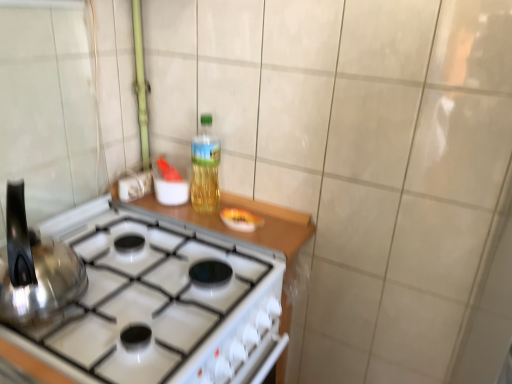
Question: Considering the relative sizes of translucent plastic bottle at center and satin silver kettle at left in the image provided, is translucent plastic bottle at center wider than satin silver kettle at left?

Choices:
 (A) yes
 (B) no

Answer: (B)

Question: Can you confirm if translucent plastic bottle at center is bigger than satin silver kettle at left?

Choices:
 (A) yes
 (B) no

Answer: (B)

Question: Is translucent plastic bottle at center touching satin silver kettle at left?

Choices:
 (A) no
 (B) yes

Answer: (A)

Question: Is translucent plastic bottle at center outside satin silver kettle at left?

Choices:
 (A) yes
 (B) no

Answer: (A)

Question: Can you confirm if translucent plastic bottle at center is positioned to the left of satin silver kettle at left?

Choices:
 (A) yes
 (B) no

Answer: (B)

Question: Considering the relative positions of white glossy gas stove at center and satin silver kettle at left in the image provided, is white glossy gas stove at center to the left or to the right of satin silver kettle at left?

Choices:
 (A) right
 (B) left

Answer: (A)

Question: Does point (226, 297) appear closer or farther from the camera than point (17, 314)?

Choices:
 (A) closer
 (B) farther

Answer: (B)

Question: Considering their positions, is white glossy gas stove at center located in front of or behind satin silver kettle at left?

Choices:
 (A) behind
 (B) front

Answer: (A)

Question: Is white glossy gas stove at center bigger or smaller than satin silver kettle at left?

Choices:
 (A) big
 (B) small

Answer: (A)

Question: From a real-world perspective, is satin silver kettle at left physically located above or below translucent plastic bottle at center?

Choices:
 (A) below
 (B) above

Answer: (A)

Question: Looking at their shapes, would you say satin silver kettle at left is wider or thinner than translucent plastic bottle at center?

Choices:
 (A) wide
 (B) thin

Answer: (A)

Question: From the image's perspective, is satin silver kettle at left above or below translucent plastic bottle at center?

Choices:
 (A) below
 (B) above

Answer: (A)

Question: Does point (61, 301) appear closer or farther from the camera than point (199, 188)?

Choices:
 (A) closer
 (B) farther

Answer: (A)

Question: Do you think satin silver kettle at left is within white glossy gas stove at center, or outside of it?

Choices:
 (A) inside
 (B) outside

Answer: (B)

Question: Considering the positions of satin silver kettle at left and white glossy gas stove at center in the image, is satin silver kettle at left wider or thinner than white glossy gas stove at center?

Choices:
 (A) wide
 (B) thin

Answer: (B)